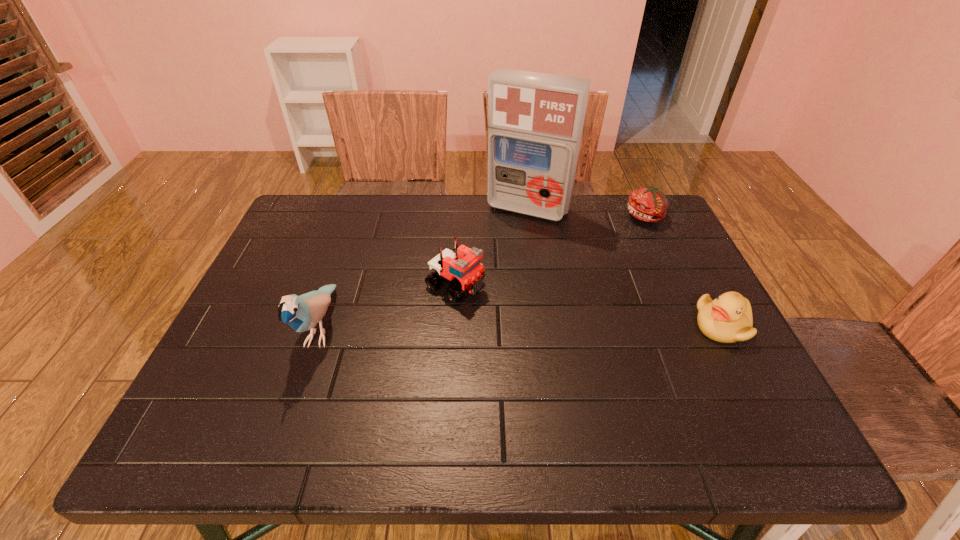
You are a GUI agent. You are given a task and a screenshot of the screen. Output one action in this format:
    pyautogui.click(x=<x>, y=<y>)
    Task: Click on the free space at the far right corner of the desktop
    This screenshot has height=540, width=960.
    Given the screenshot: What is the action you would take?
    pyautogui.click(x=613, y=211)

Locate an element on the screen. This screenshot has width=960, height=540. vacant region between the tallest object and the tomato is located at coordinates (588, 213).

Locate an element on the screen. The image size is (960, 540). vacant space that is in between the duckling and the first-aid kit is located at coordinates (625, 267).

Identify the location of free spot between the first-aid kit and the fourth object from right to left. (492, 247).

In order to click on blank region between the tallest object and the fourth shortest object in this screenshot , I will do `click(424, 268)`.

You are a GUI agent. You are given a task and a screenshot of the screen. Output one action in this format:
    pyautogui.click(x=<x>, y=<y>)
    Task: Click on the vacant region between the duckling and the tomato
    The height and width of the screenshot is (540, 960).
    Given the screenshot: What is the action you would take?
    pyautogui.click(x=684, y=271)

This screenshot has width=960, height=540. Find the location of `vacant space in between the leftmost object and the duckling`. vacant space in between the leftmost object and the duckling is located at coordinates (521, 327).

Where is `vacant space that's between the duckling and the tomato`? vacant space that's between the duckling and the tomato is located at coordinates (684, 271).

Where is `unoccupied area between the tomato and the duckling`? This screenshot has height=540, width=960. unoccupied area between the tomato and the duckling is located at coordinates (684, 271).

Find the location of a particular element. The width and height of the screenshot is (960, 540). free spot between the first-aid kit and the fourth object from right to left is located at coordinates (492, 247).